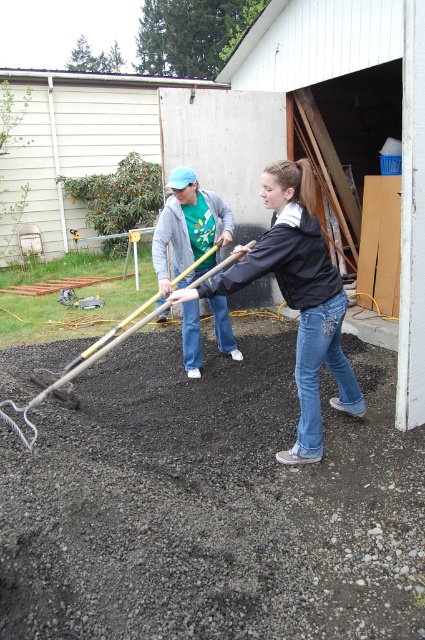
Question: Which object appears farthest from the camera in this image?

Choices:
 (A) wooden handle rake at lower left
 (B) denim jeans at center

Answer: (A)

Question: Which point is closer to the camera taking this photo?

Choices:
 (A) (107, 346)
 (B) (300, 460)

Answer: (A)

Question: Is denim jeans at center above wooden handle rake at lower left?

Choices:
 (A) no
 (B) yes

Answer: (B)

Question: Does denim jeans at center appear under wooden handle rake at lower left?

Choices:
 (A) no
 (B) yes

Answer: (A)

Question: Is denim jeans at center closer to camera compared to wooden handle rake at lower left?

Choices:
 (A) yes
 (B) no

Answer: (A)